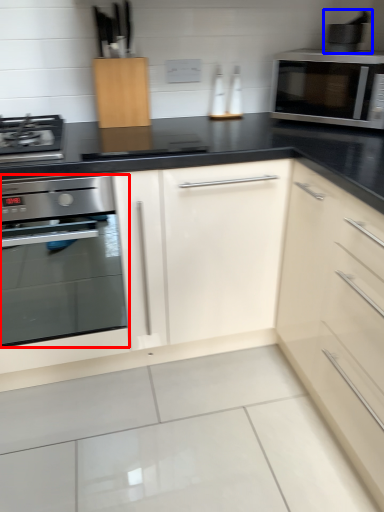
Question: Which object is closer to the camera taking this photo, oven (highlighted by a red box) or appliance (highlighted by a blue box)?

Choices:
 (A) oven
 (B) appliance

Answer: (A)